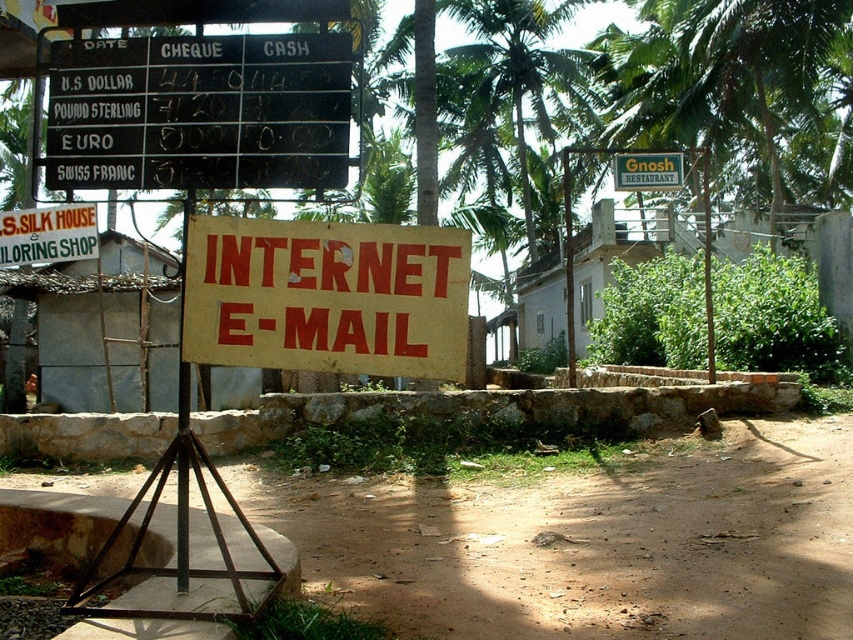
Between point (633, 545) and point (656, 179), which one is positioned in front?

Point (633, 545)

Is point (247, 508) closer to camera compared to point (637, 182)?

Yes, it is in front of point (637, 182).

Find the location of a particular element. brown dirt field at center is located at coordinates (589, 540).

In the scene shown: Which is above, gray corrugated metal hut at left or yellow paper sign at center?

yellow paper sign at center

Describe the element at coordinates (65, 332) in the screenshot. I see `gray corrugated metal hut at left` at that location.

This screenshot has width=853, height=640. What are the coordinates of `gray corrugated metal hut at left` in the screenshot? It's located at (65, 332).

This screenshot has height=640, width=853. I want to click on gray corrugated metal hut at left, so click(x=65, y=332).

Who is shorter, yellow/yellowish paper sign at center or gray corrugated metal hut at left?

gray corrugated metal hut at left

Between point (375, 296) and point (48, 266), which one is positioned in front?

Point (375, 296) is in front.

Locate an element on the screen. This screenshot has width=853, height=640. yellow/yellowish paper sign at center is located at coordinates (328, 296).